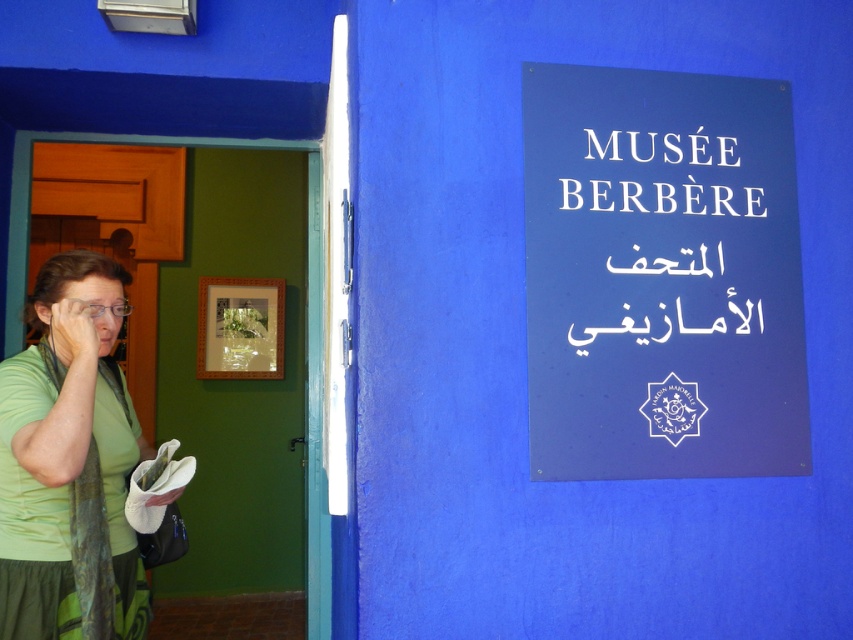
Question: Which is farther from the green fabric scarf at left?

Choices:
 (A) white plastic sign at upper right
 (B) blue plastic sign at upper right
 (C) translucent plastic nose at center

Answer: (A)

Question: Estimate the real-world distances between objects in this image. Which object is farther from the blue plastic sign at upper right?

Choices:
 (A) white plastic sign at upper right
 (B) translucent plastic nose at center

Answer: (B)

Question: Which point is closer to the camera?

Choices:
 (A) (16, 364)
 (B) (106, 317)
 (C) (718, 314)

Answer: (C)

Question: Is green fabric scarf at left to the right of white plastic sign at upper right from the viewer's perspective?

Choices:
 (A) no
 (B) yes

Answer: (A)

Question: Is blue plastic sign at upper right below translucent plastic nose at center?

Choices:
 (A) yes
 (B) no

Answer: (B)

Question: Can you confirm if green fabric scarf at left is positioned above translucent plastic nose at center?

Choices:
 (A) no
 (B) yes

Answer: (A)